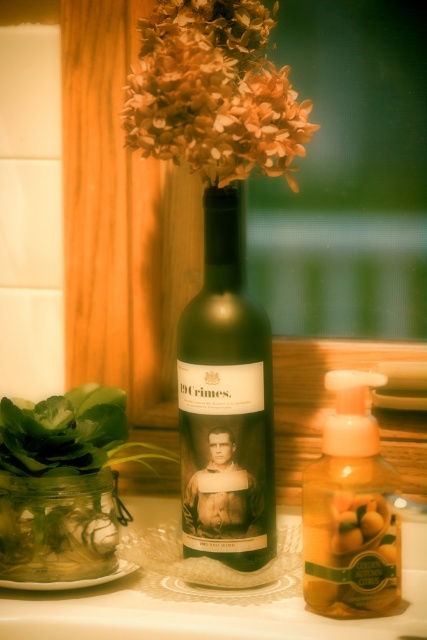
Is orange matte flowers at upper center thinner than clear glass jar at lower left?

Incorrect, orange matte flowers at upper center's width is not less than clear glass jar at lower left's.

Is point (184, 108) behind point (75, 508)?

That is False.

Locate an element on the screen. orange matte flowers at upper center is located at coordinates (213, 92).

Between yellow translucent soap dispenser at center and yellow matte soap at center, which one is positioned higher?

Positioned higher is yellow translucent soap dispenser at center.

From the picture: Which is more to the left, yellow translucent soap dispenser at center or yellow matte soap at center?

yellow matte soap at center

Does point (356, 480) come behind point (338, 532)?

Yes, point (356, 480) is farther from viewer.

Image resolution: width=427 pixels, height=640 pixels. Find the location of `yellow translucent soap dispenser at center`. yellow translucent soap dispenser at center is located at coordinates (350, 509).

Can you confirm if yellow translucent soap dispenser at center is bigger than clear glass jar at lower left?

Correct, yellow translucent soap dispenser at center is larger in size than clear glass jar at lower left.

Image resolution: width=427 pixels, height=640 pixels. What do you see at coordinates (350, 509) in the screenshot? I see `yellow translucent soap dispenser at center` at bounding box center [350, 509].

Does point (382, 476) come behind point (99, 554)?

No, it is in front of (99, 554).

At what (x,y) coordinates should I click in order to perform the action: click on yellow translucent soap dispenser at center. Please return your answer as a coordinate pair (x, y). Image resolution: width=427 pixels, height=640 pixels. Looking at the image, I should click on (350, 509).